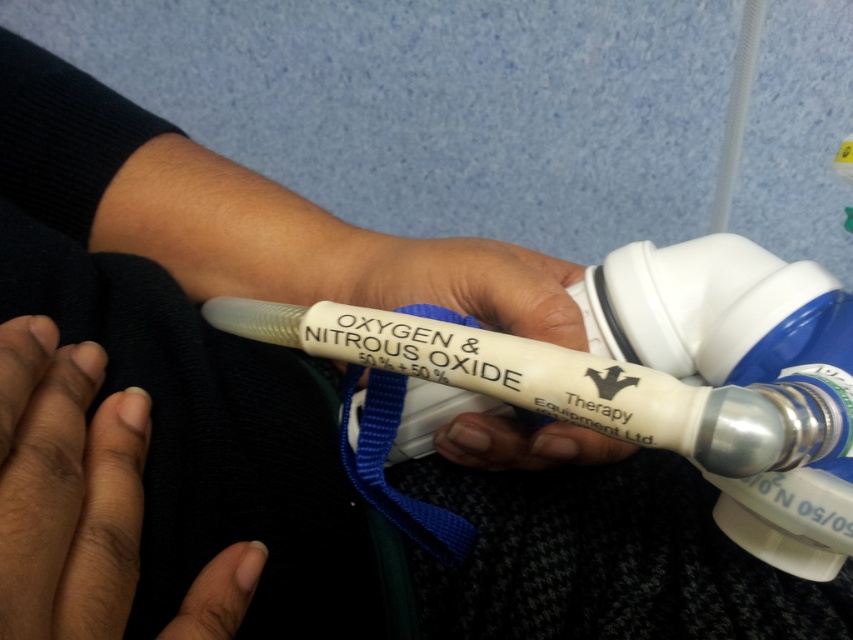
You are a dental assistant and need to ensure the patient can comfortably hold the device during a procedure. The device has a point at coordinates point [12,492]. If the patient can reach up to 10 inches, will they be able to reach this point?

The point [12,492] is 9.61 inches away from the camera, so yes, the patient can reach it since their maximum reach is 10 inches.

In the scene shown: You are a dental assistant preparing to administer the inhalation system. The patient has a medical device in their hand. How far apart are the dark skin at lower left and the white matte oxygen mask at center?

The dark skin at lower left is 16.11 centimeters from the white matte oxygen mask at center.

What are the coordinates of the dark skin at lower left?

The coordinates of the dark skin at lower left are at point (67,486).